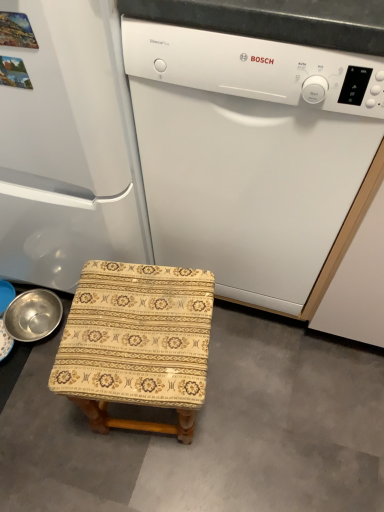
Image resolution: width=384 pixels, height=512 pixels. Find the location of `vacant region in front of patterned fabric stool at center`. vacant region in front of patterned fabric stool at center is located at coordinates (152, 479).